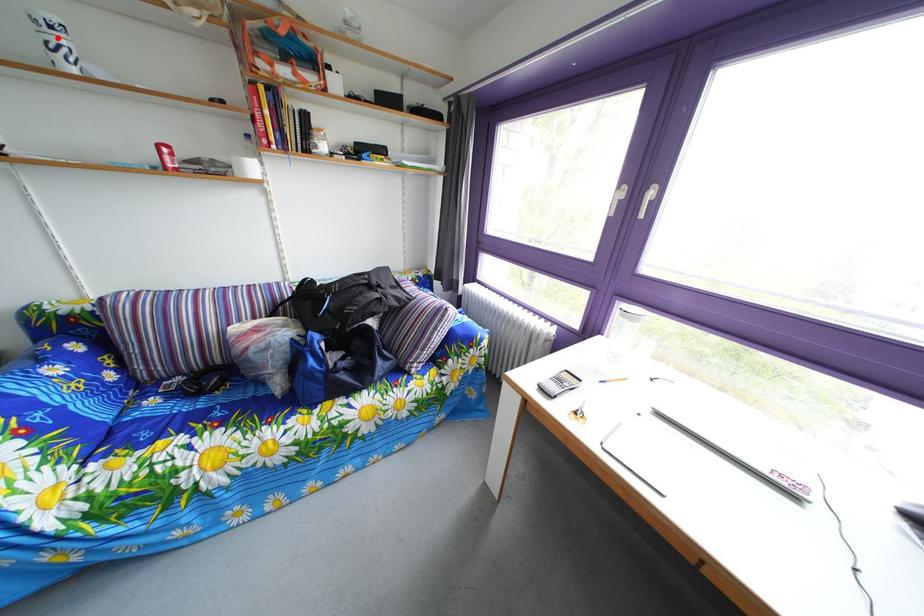
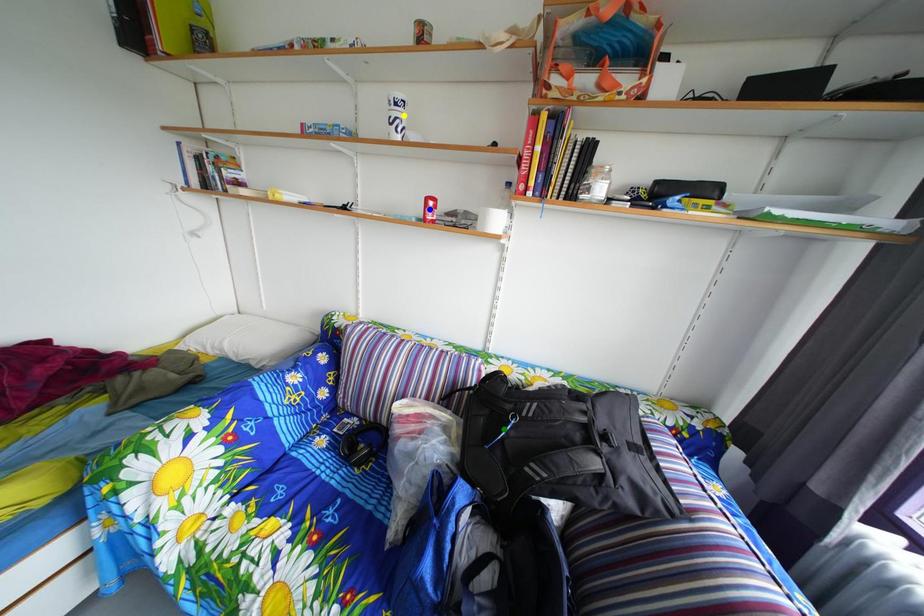
Question: I am providing you with two images of the same scene from different viewpoints. A red point is marked on the first image. You are given multiple points on the second image. Which spot in image 2 lines up with the point in image 1?

Choices:
 (A) yellow point
 (B) blue point
 (C) green point

Answer: (A)